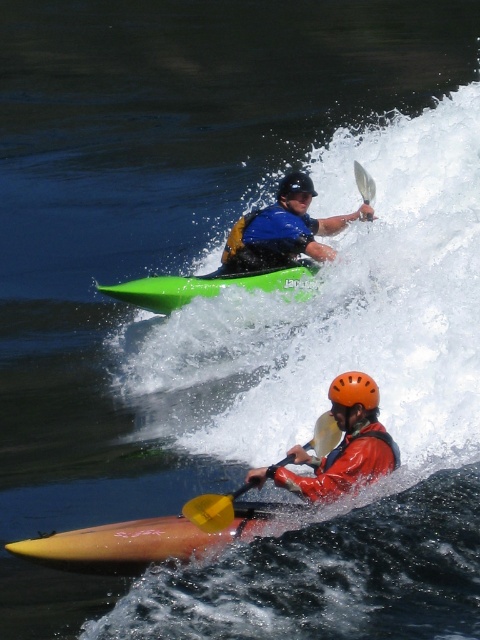
You are a photographer trying to capture a shot of the blue matte life jacket at center and the white plastic paddle at upper center. Based on their positions, which object should you focus on first to ensure both are in the frame?

The blue matte life jacket at center is to the left of the white plastic paddle at upper center, so you should focus on the blue matte life jacket at center first to ensure both are in the frame.

You are a photographer trying to capture both the green matte kayak at upper center and the orange matte helmet at lower center in a single frame. Based on their positions, which object should you focus on first to ensure both are in the frame?

The green matte kayak at upper center is located above the orange matte helmet at lower center, so you should focus on the green matte kayak at upper center first to ensure both are in the frame.